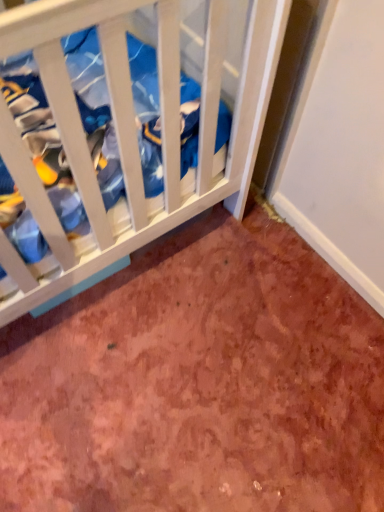
Measure the distance between point (52, 330) and camera.

Point (52, 330) is 1.22 meters away from camera.

Identify the location of brown textured carpet at lower center. (199, 382).

This screenshot has width=384, height=512. Describe the element at coordinates (199, 382) in the screenshot. I see `brown textured carpet at lower center` at that location.

The image size is (384, 512). Describe the element at coordinates (131, 132) in the screenshot. I see `white wood crib at upper left` at that location.

In order to face white wood crib at upper left, should I rotate leftwards or rightwards?

Turn left by 17.052 degrees to look at white wood crib at upper left.

This screenshot has width=384, height=512. I want to click on white wood crib at upper left, so click(x=131, y=132).

I want to click on brown textured carpet at lower center, so click(199, 382).

Consider the image. Between white wood crib at upper left and brown textured carpet at lower center, which one appears on the left side from the viewer's perspective?

white wood crib at upper left is more to the left.

Considering the relative positions of white wood crib at upper left and brown textured carpet at lower center in the image provided, is white wood crib at upper left behind brown textured carpet at lower center?

No, it is not.

Considering the points (277, 9) and (303, 352), which point is in front, point (277, 9) or point (303, 352)?

The point (277, 9) is closer.

From the image's perspective, would you say white wood crib at upper left is positioned over brown textured carpet at lower center?

Yes, from the image's perspective, white wood crib at upper left is over brown textured carpet at lower center.

From a real-world perspective, who is located higher, white wood crib at upper left or brown textured carpet at lower center?

white wood crib at upper left, from a real-world perspective.

Considering the sizes of white wood crib at upper left and brown textured carpet at lower center in the image, is white wood crib at upper left wider or thinner than brown textured carpet at lower center?

Considering their sizes, white wood crib at upper left looks slimmer than brown textured carpet at lower center.

Looking at this image, does white wood crib at upper left have a lesser height compared to brown textured carpet at lower center?

No.

Which of these two, white wood crib at upper left or brown textured carpet at lower center, is bigger?

white wood crib at upper left.

Would you say white wood crib at upper left is inside or outside brown textured carpet at lower center?

white wood crib at upper left is outside brown textured carpet at lower center.

Are white wood crib at upper left and brown textured carpet at lower center making contact?

white wood crib at upper left and brown textured carpet at lower center are not in contact.

Could you tell me if white wood crib at upper left is turned towards brown textured carpet at lower center?

No, white wood crib at upper left does not turn towards brown textured carpet at lower center.

In the scene shown: What's the angular difference between white wood crib at upper left and brown textured carpet at lower center's facing directions?

white wood crib at upper left and brown textured carpet at lower center are facing 1.2 degrees away from each other.

Locate an element on the screen. dirt that appears behind the white wood crib at upper left is located at coordinates (x=199, y=382).

Between brown textured carpet at lower center and white wood crib at upper left, which one appears on the left side from the viewer's perspective?

From the viewer's perspective, white wood crib at upper left appears more on the left side.

Is brown textured carpet at lower center in front of white wood crib at upper left?

No, it is behind white wood crib at upper left.

Which point is more forward, (x=133, y=269) or (x=234, y=207)?

The point (x=133, y=269) is closer.

From the image's perspective, is brown textured carpet at lower center above or below white wood crib at upper left?

Based on their image positions, brown textured carpet at lower center is located beneath white wood crib at upper left.

From a real-world perspective, is brown textured carpet at lower center below white wood crib at upper left?

Yes, from a real-world perspective, brown textured carpet at lower center is under white wood crib at upper left.

Does brown textured carpet at lower center have a lesser width compared to white wood crib at upper left?

Incorrect, the width of brown textured carpet at lower center is not less than that of white wood crib at upper left.

Can you confirm if brown textured carpet at lower center is taller than white wood crib at upper left?

No, brown textured carpet at lower center is not taller than white wood crib at upper left.

Who is smaller, brown textured carpet at lower center or white wood crib at upper left?

brown textured carpet at lower center is smaller.

Is brown textured carpet at lower center completely or partially outside of white wood crib at upper left?

Yes.

Are brown textured carpet at lower center and white wood crib at upper left located far from each other?

Actually, brown textured carpet at lower center and white wood crib at upper left are a little close together.

Is brown textured carpet at lower center facing away from white wood crib at upper left?

brown textured carpet at lower center is not turned away from white wood crib at upper left.

How different are the orientations of brown textured carpet at lower center and white wood crib at upper left in degrees?

There is a 1.2-degree angle between the facing directions of brown textured carpet at lower center and white wood crib at upper left.

You are a GUI agent. You are given a task and a screenshot of the screen. Output one action in this format:
    pyautogui.click(x=<x>, y=<y>)
    Task: Click on the dirt located underneath the white wood crib at upper left (from a real-world perspective)
    The height and width of the screenshot is (512, 384).
    Given the screenshot: What is the action you would take?
    pyautogui.click(x=199, y=382)

What are the coordinates of `dirt behind the white wood crib at upper left` in the screenshot? It's located at (199, 382).

The image size is (384, 512). I want to click on infant bed on the left side of brown textured carpet at lower center, so click(x=131, y=132).